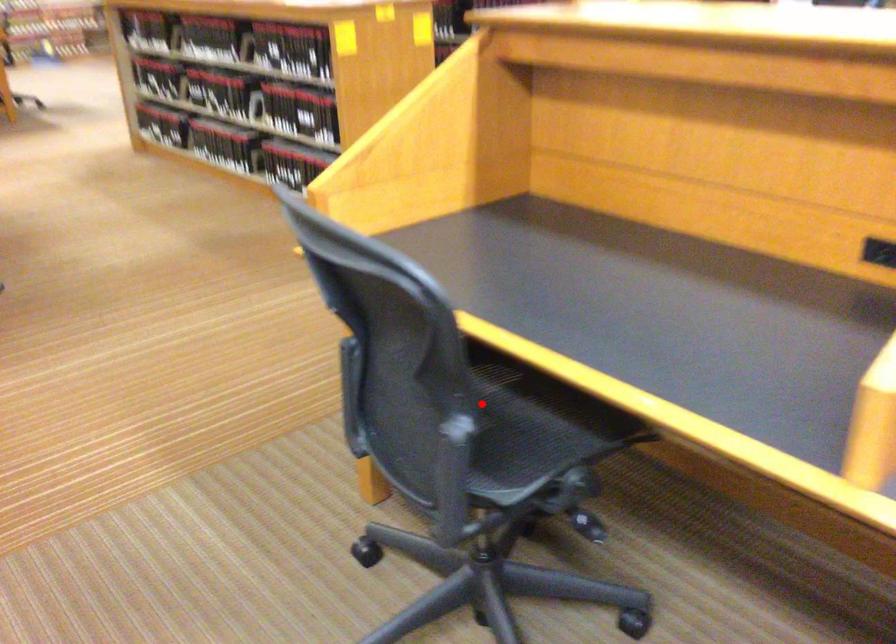
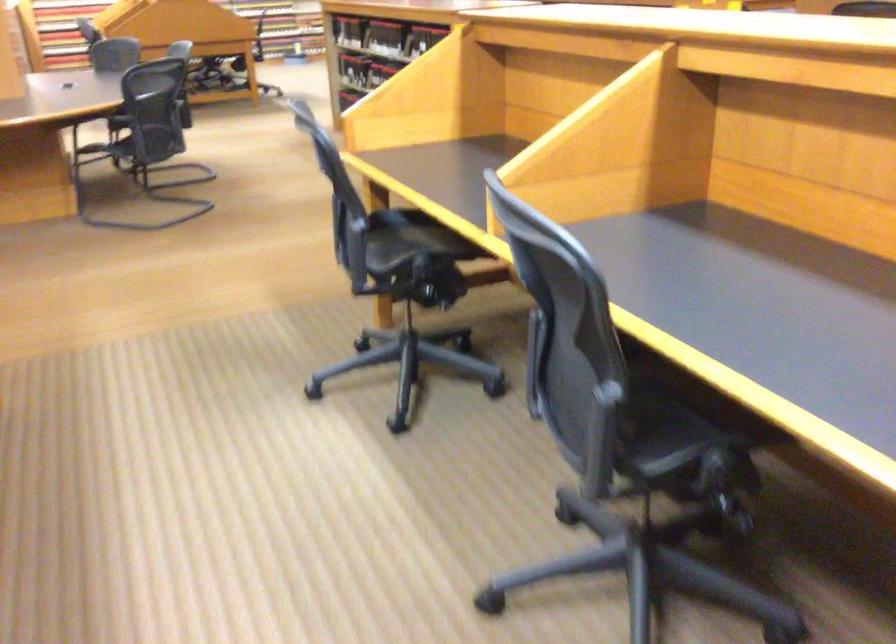
Question: I am providing you with two images of the same scene from different viewpoints. A red point is shown in image1. For the corresponding object point in image2, is it positioned nearer or farther from the camera?

Choices:
 (A) Nearer
 (B) Farther

Answer: (B)